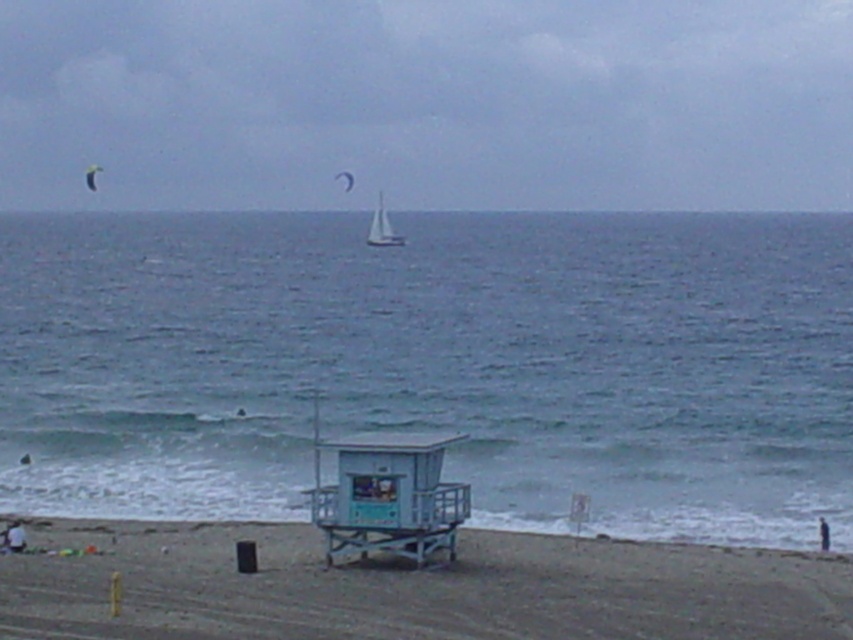
You are a beachgoer planning to set up a small tent on the brown sandy beach at lower center. Considering the space available, can you estimate whether the blue water at center might come closer to your tent during high tide?

The blue water at center is wider than the brown sandy beach at lower center, so during high tide, the blue water at center could potentially come closer to your tent on the brown sandy beach at lower center.

You are standing on the beach looking at the scene. You want to take a photo of the matte white sailboat at upper center. If your camera can focus on objects up to 250 meters away, will you be able to capture a clear image of the boat?

The matte white sailboat at upper center is 269.53 meters from viewer, which is beyond the camera focus range of 250 meters. Therefore, you won cannot capture a clear image of the boat.

You are a photographer planning to capture the entire scene in one shot. Given that the matte white sailboat at upper center and the light blue wood lifeguard tower at center are both in your frame, which object would require more horizontal space to fully capture in your photo?

The matte white sailboat at upper center requires more horizontal space to fully capture in the photo because its width surpasses that of the light blue wood lifeguard tower at center.